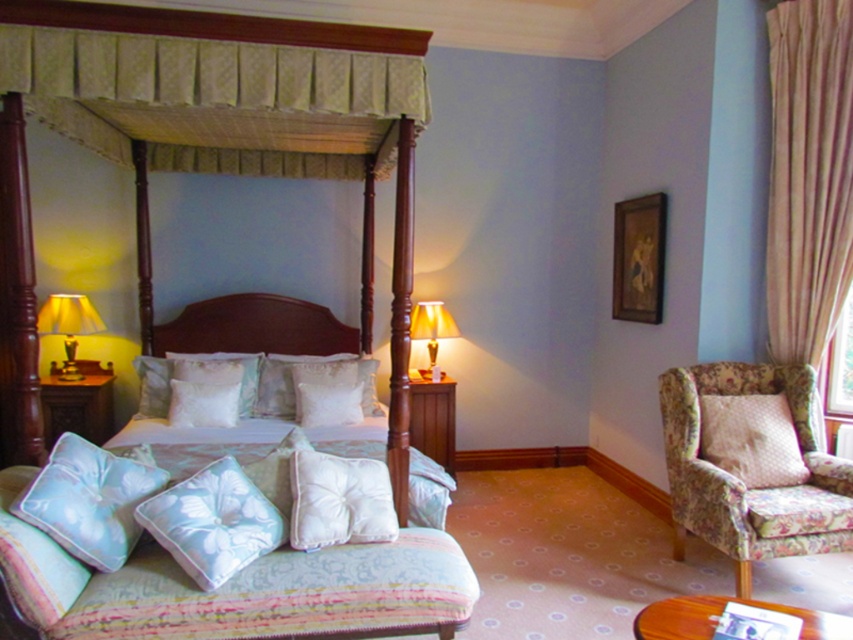
Who is more forward, [64,502] or [93,413]?

Point [64,502] is more forward.

This screenshot has width=853, height=640. What are the coordinates of `light blue satin pillow at lower left` in the screenshot? It's located at (90, 499).

In order to click on light blue satin pillow at lower left in this screenshot , I will do `click(90, 499)`.

Does point (740, 401) come in front of point (238, 518)?

No.

Is floral fabric armchair at right closer to camera compared to light blue fabric cushion at lower center?

No, floral fabric armchair at right is further to the viewer.

Is point (711, 404) farther from camera compared to point (273, 524)?

That is True.

Identify the location of floral fabric armchair at right. (752, 464).

Can you confirm if matte gold fabric canopy bed at center is taller than light blue fabric cushion at lower center?

Yes, matte gold fabric canopy bed at center is taller than light blue fabric cushion at lower center.

Describe the element at coordinates (241, 115) in the screenshot. The height and width of the screenshot is (640, 853). I see `matte gold fabric canopy bed at center` at that location.

This screenshot has height=640, width=853. Identify the location of matte gold fabric canopy bed at center. (241, 115).